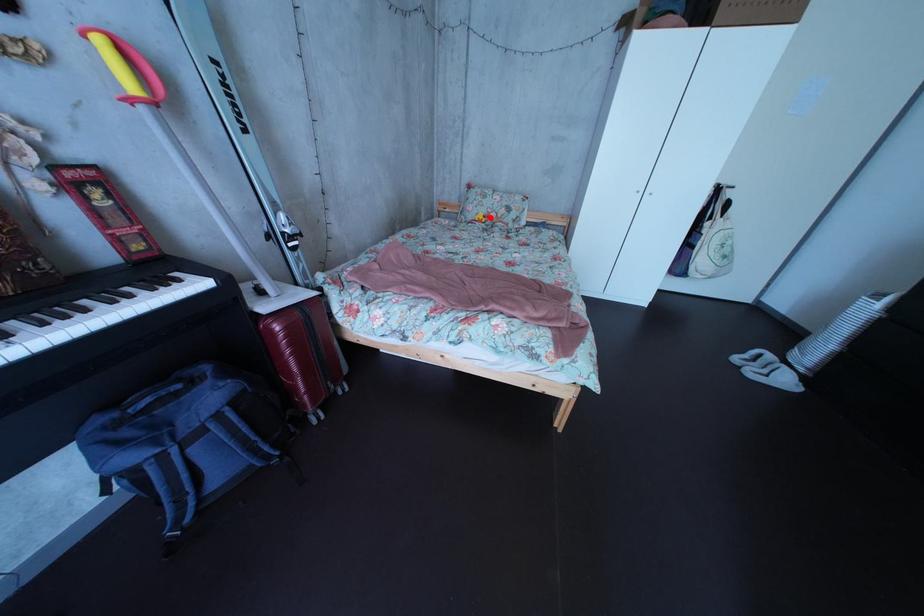
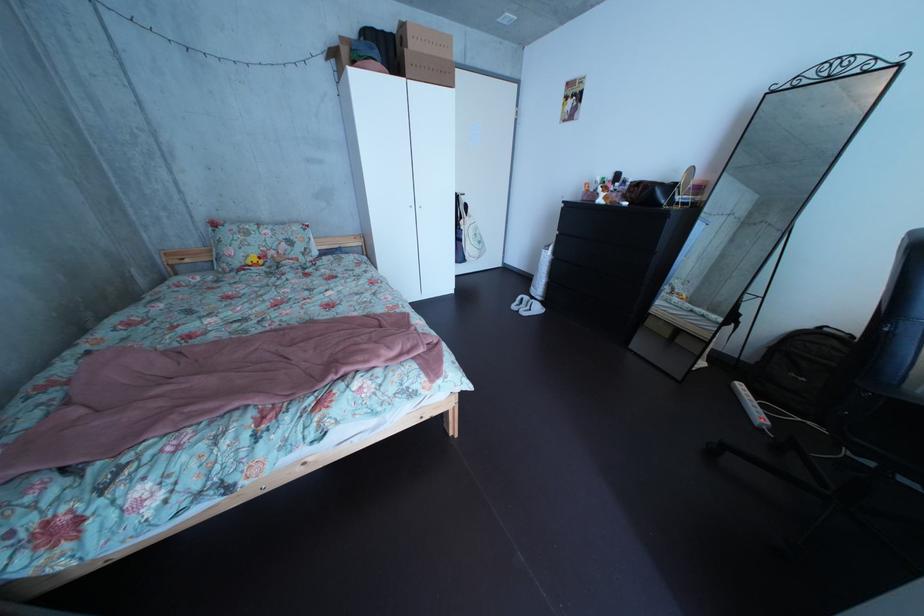
Question: I am providing you with two images of the same scene from different viewpoints. Given a red point in image1, look at the same physical point in image2. Is it:

Choices:
 (A) Closer to the viewpoint
 (B) Farther from the viewpoint

Answer: (B)